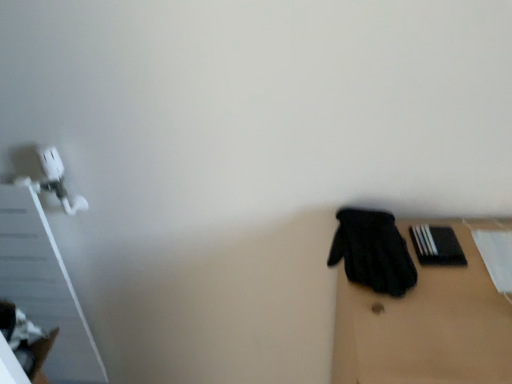
This screenshot has height=384, width=512. Describe the element at coordinates (373, 251) in the screenshot. I see `black fabric glove at right` at that location.

Where is `black fabric glove at right`? Image resolution: width=512 pixels, height=384 pixels. black fabric glove at right is located at coordinates (373, 251).

Is black matte book at right positioned with its back to black fabric glove at right?

black matte book at right is not turned away from black fabric glove at right.

From the image's perspective, between black matte book at right and black fabric glove at right, who is located below?

black fabric glove at right.

Is black matte book at right not close to black fabric glove at right?

No, black matte book at right is not far from black fabric glove at right.

How distant is black matte book at right from black fabric glove at right?

3.78 inches.

Is black matte gloves at right next to black fabric glove at right and touching it?

Yes, black matte gloves at right is touching black fabric glove at right.

Is black matte gloves at right thinner than black fabric glove at right?

No.

From a real-world perspective, is black matte gloves at right above or below black fabric glove at right?

In terms of real-world spatial position, black matte gloves at right is below black fabric glove at right.

From the image's perspective, does black matte gloves at right appear lower than black fabric glove at right?

Indeed, from the image's perspective, black matte gloves at right is shown beneath black fabric glove at right.

Can you confirm if black fabric glove at right is thinner than black matte gloves at right?

Correct, the width of black fabric glove at right is less than that of black matte gloves at right.

Is black fabric glove at right positioned far away from black matte gloves at right?

No, black fabric glove at right is in close proximity to black matte gloves at right.

Is black fabric glove at right inside the boundaries of black matte gloves at right, or outside?

black fabric glove at right is spatially positioned inside black matte gloves at right.

The width and height of the screenshot is (512, 384). In order to click on bin that appears on the right of black fabric glove at right in this screenshot , I will do `click(436, 245)`.

Can you confirm if black fabric glove at right is positioned to the right of black matte book at right?

Incorrect, black fabric glove at right is not on the right side of black matte book at right.

Is black fabric glove at right turned away from black matte book at right?

black fabric glove at right does not have its back to black matte book at right.

Considering the positions of points (426, 258) and (336, 318), is point (426, 258) farther from camera compared to point (336, 318)?

No, it is not.

Is black matte book at right not close to black matte gloves at right?

No.

In order to click on table to the right of black matte book at right in this screenshot , I will do `click(426, 323)`.

Based on the photo, could you tell me if black matte book at right is facing black matte gloves at right?

No, black matte book at right is not aimed at black matte gloves at right.

Is black matte gloves at right not within black matte book at right?

Yes.

Considering the positions of objects black matte gloves at right and black matte book at right in the image provided, who is behind, black matte gloves at right or black matte book at right?

black matte book at right.

From the image's perspective, is black matte gloves at right below black matte book at right?

Correct, black matte gloves at right appears lower than black matte book at right in the image.

Consider the image. Between black matte gloves at right and black matte book at right, which one has less height?

black matte book at right is shorter.

Locate an element on the screen. The width and height of the screenshot is (512, 384). bin below the black fabric glove at right (from a real-world perspective) is located at coordinates (436, 245).

You are a GUI agent. You are given a task and a screenshot of the screen. Output one action in this format:
    pyautogui.click(x=<x>, y=<y>)
    Task: Click on the table located in front of the black fabric glove at right
    This screenshot has height=384, width=512.
    Given the screenshot: What is the action you would take?
    pyautogui.click(x=426, y=323)

Estimate the real-world distances between objects in this image. Which object is closer to black fabric glove at right, black matte book at right or black matte gloves at right?

The object closer to black fabric glove at right is black matte gloves at right.

Which object lies nearer to the anchor point black matte book at right, black matte gloves at right or black fabric glove at right?

black fabric glove at right lies closer to black matte book at right than the other object.

Looking at this image, estimate the real-world distances between objects in this image. Which object is closer to black matte gloves at right, black fabric glove at right or black matte book at right?

The object closer to black matte gloves at right is black fabric glove at right.

Based on their spatial positions, is black matte book at right or black fabric glove at right closer to black matte gloves at right?

black fabric glove at right is closer to black matte gloves at right.

Considering their positions, is black fabric glove at right positioned further to black matte book at right than black matte gloves at right?

Among the two, black matte gloves at right is located further to black matte book at right.

Considering their positions, is black matte gloves at right positioned further to black fabric glove at right than black matte book at right?

black matte book at right is further to black fabric glove at right.

Where is `glove that lies between black matte book at right and black matte gloves at right from top to bottom`? The width and height of the screenshot is (512, 384). glove that lies between black matte book at right and black matte gloves at right from top to bottom is located at coordinates (373, 251).